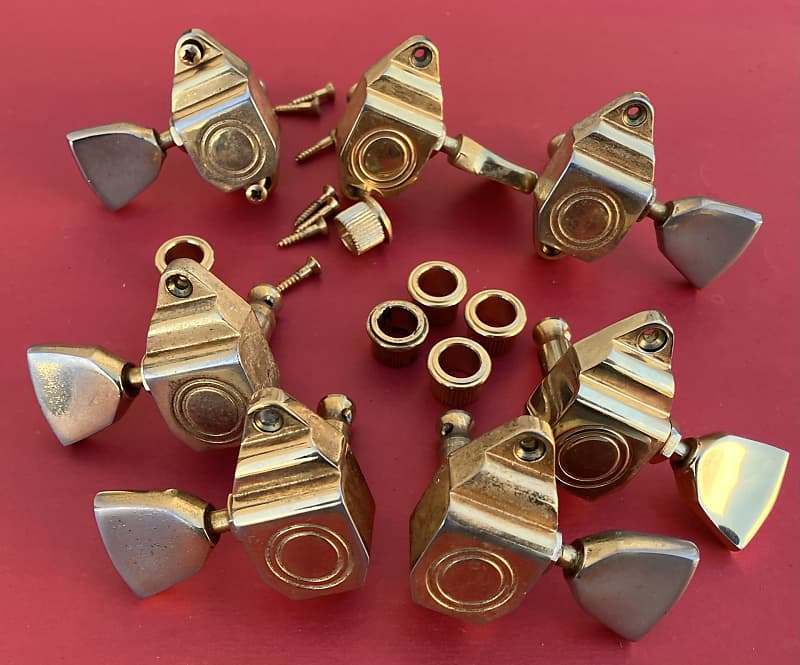
The width and height of the screenshot is (800, 665). Identify the location of screws. (312, 223), (301, 106).